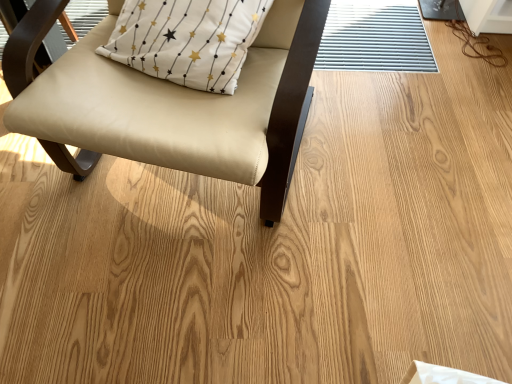
Question: From the image's perspective, relative to beige leather chair at upper left, is white fabric pillow at upper left above or below?

Choices:
 (A) above
 (B) below

Answer: (A)

Question: Considering the relative positions of white fabric pillow at upper left and beige leather chair at upper left in the image provided, is white fabric pillow at upper left to the left or to the right of beige leather chair at upper left?

Choices:
 (A) left
 (B) right

Answer: (B)

Question: From a real-world perspective, is white fabric pillow at upper left above or below beige leather chair at upper left?

Choices:
 (A) above
 (B) below

Answer: (A)

Question: From the image's perspective, is beige leather chair at upper left positioned above or below white fabric pillow at upper left?

Choices:
 (A) below
 (B) above

Answer: (A)

Question: Considering the positions of point (62, 96) and point (234, 9), is point (62, 96) closer or farther from the camera than point (234, 9)?

Choices:
 (A) farther
 (B) closer

Answer: (B)

Question: Is beige leather chair at upper left in front of or behind white fabric pillow at upper left in the image?

Choices:
 (A) front
 (B) behind

Answer: (A)

Question: Looking at their shapes, would you say beige leather chair at upper left is wider or thinner than white fabric pillow at upper left?

Choices:
 (A) wide
 (B) thin

Answer: (A)